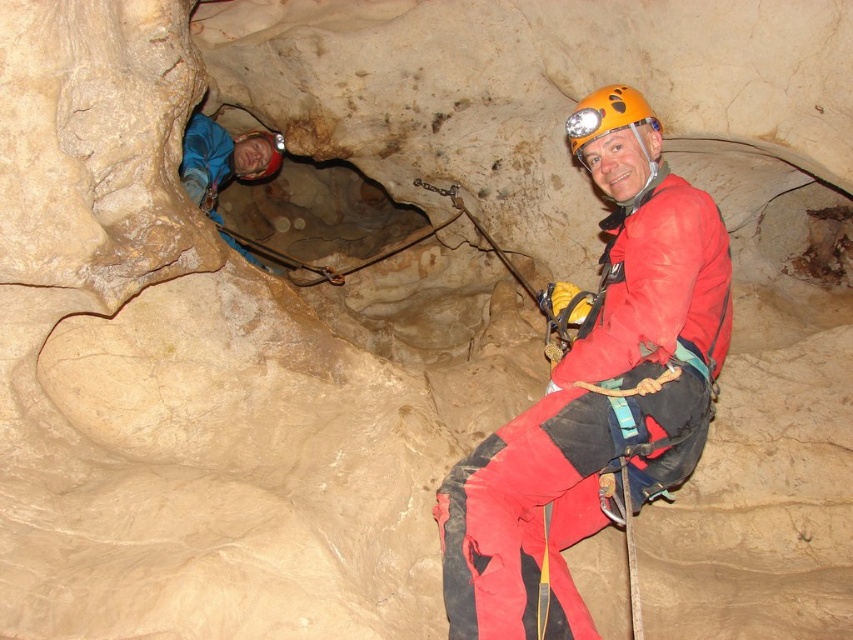
You are planning to choose a helmet for your caving trip based on the helmets visible in the image. Which helmet, the blue fabric helmet at upper left or the brushed metal helmet at upper center, has a larger size?

The blue fabric helmet at upper left is bigger than the brushed metal helmet at upper center, so the blue fabric helmet at upper left has a larger size.

You are a caving instructor assessing safety distances in the cave. The recommended minimum distance between a climber and their helmet when seated is 20 inches. Given the scene, does the distance between the matte red jumpsuit at center and the orange matte helmet at upper center meet the safety requirement?

The matte red jumpsuit at center and orange matte helmet at upper center are 21.38 inches apart, which exceeds the recommended minimum distance of 20 inches. Therefore, the safety requirement is met.